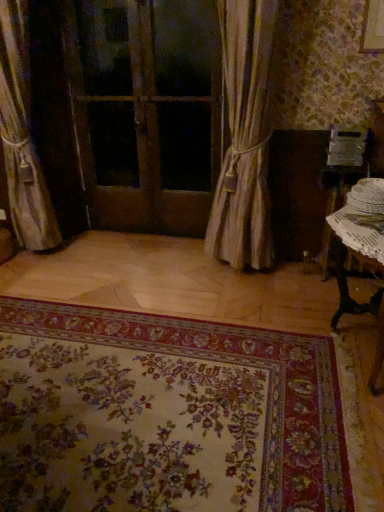
Where is `vacant area that is in front of silky beige curtain at left, which ranks as the 1th curtain in left-to-right order`? Image resolution: width=384 pixels, height=512 pixels. vacant area that is in front of silky beige curtain at left, which ranks as the 1th curtain in left-to-right order is located at coordinates [44, 268].